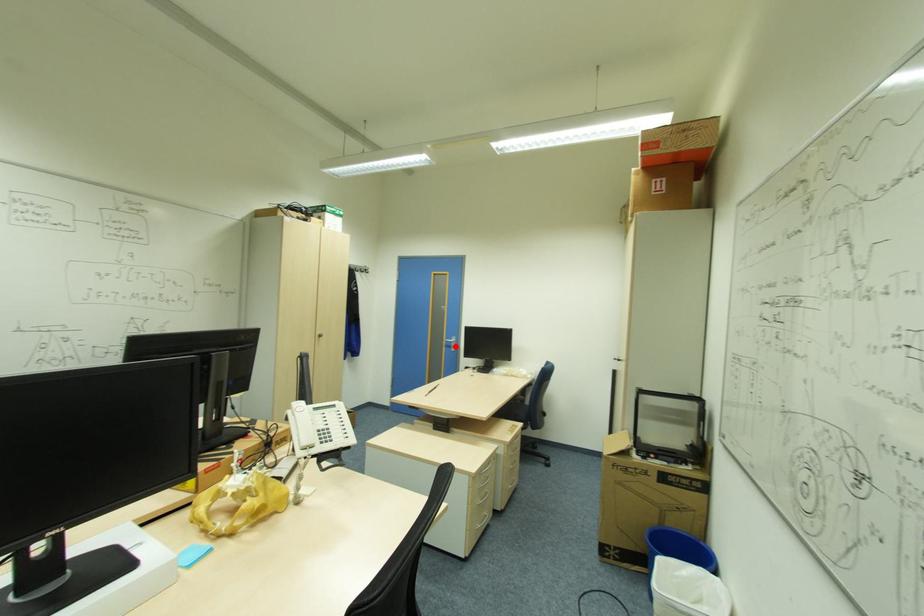
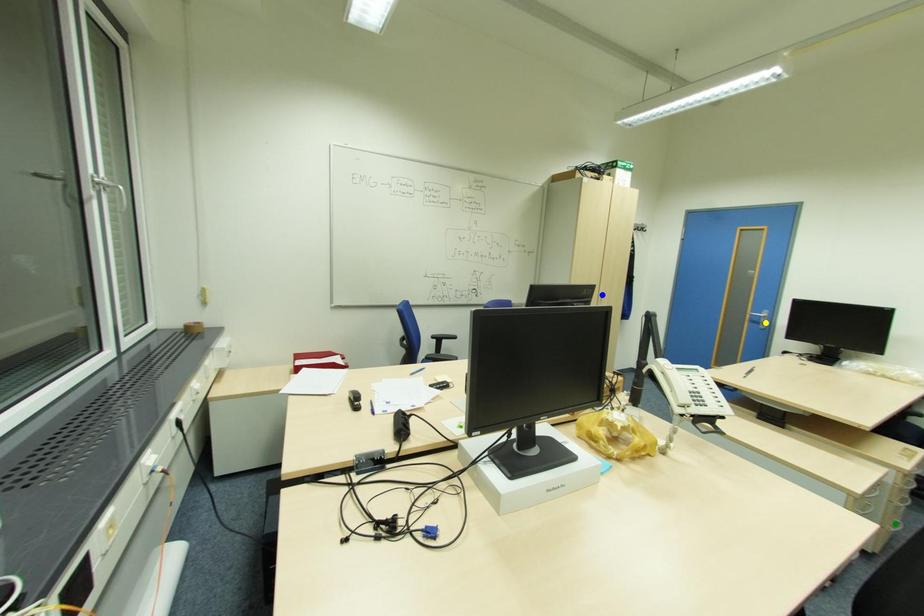
Question: I am providing you with two images of the same scene from different viewpoints. A red point is marked on the first image. You are given multiple points on the second image. Which point in image 2 represents the same 3d spot as the red point in image 1?

Choices:
 (A) yellow point
 (B) green point
 (C) blue point

Answer: (A)